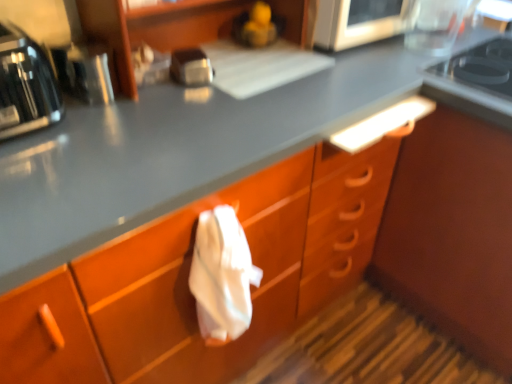
The height and width of the screenshot is (384, 512). I want to click on empty space that is to the right of shiny black toaster at left, so click(x=102, y=126).